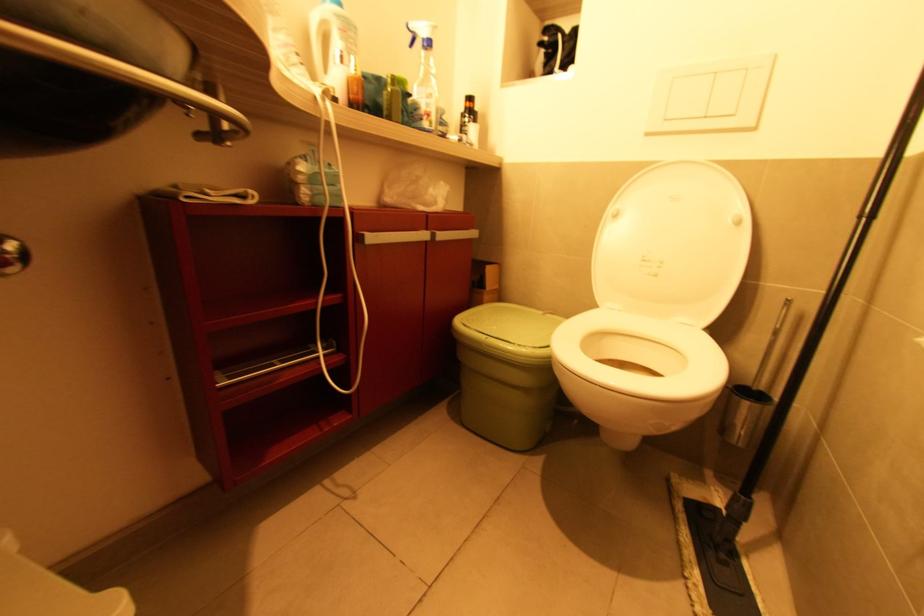
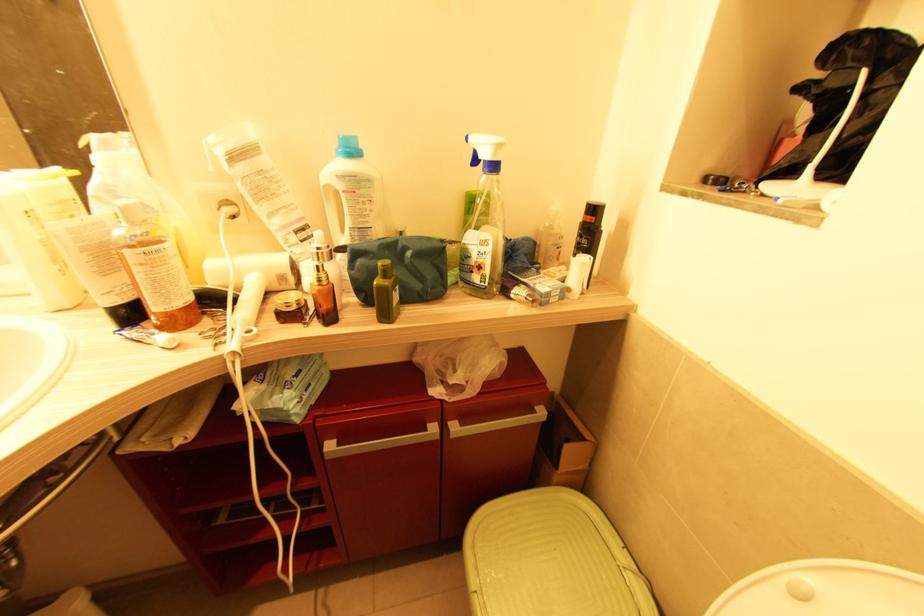
Locate, in the second image, the point that corresponds to point (563, 38) in the first image.

(867, 73)